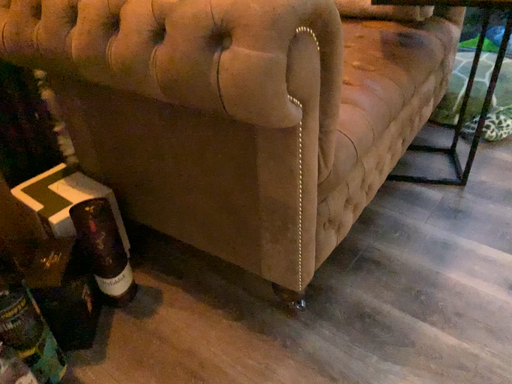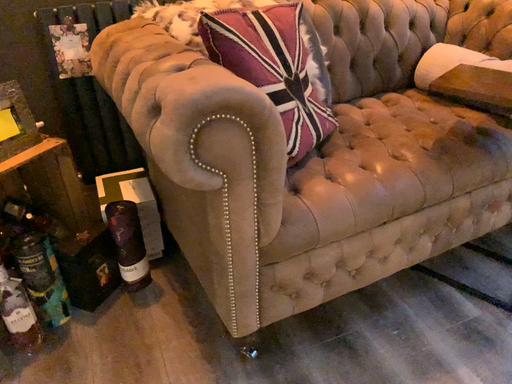
Question: How did the camera likely rotate when shooting the video?

Choices:
 (A) rotated upward
 (B) rotated downward

Answer: (A)